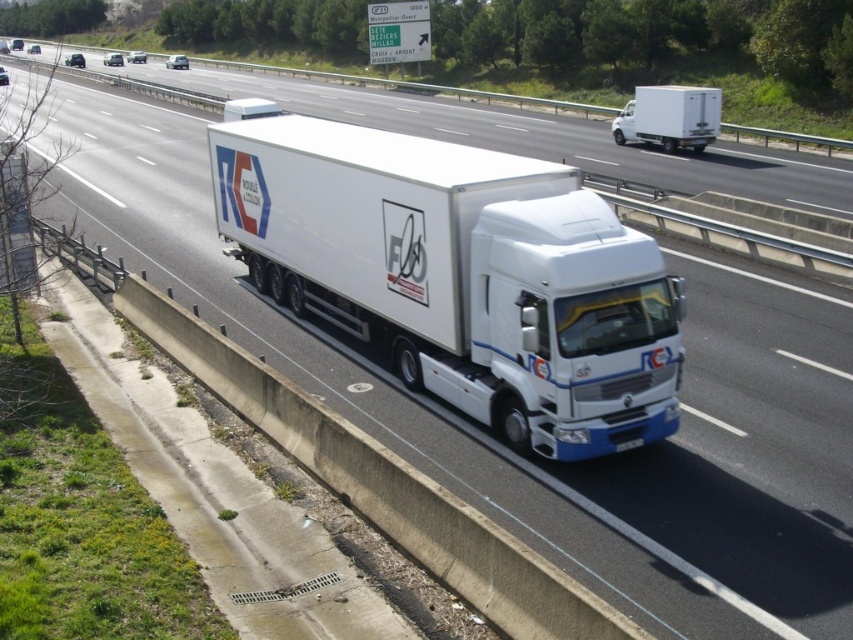
Can you confirm if white matte trailer truck at center is positioned below white glossy truck at center?

Yes, white matte trailer truck at center is below white glossy truck at center.

Is point (473, 196) farther from viewer compared to point (282, 92)?

That is False.

Which is in front, point (252, 248) or point (346, 97)?

Point (252, 248) is in front.

This screenshot has height=640, width=853. What are the coordinates of `white matte trailer truck at center` in the screenshot? It's located at (x=460, y=273).

Is white matte trailer truck at center smaller than white matte truck at upper center?

Incorrect, white matte trailer truck at center is not smaller in size than white matte truck at upper center.

Is point (447, 356) positioned before point (610, 128)?

Yes, it is in front of point (610, 128).

This screenshot has width=853, height=640. Find the location of `white matte trailer truck at center`. white matte trailer truck at center is located at coordinates (460, 273).

Is white glossy truck at center to the left of white matte truck at upper center from the viewer's perspective?

Yes, white glossy truck at center is to the left of white matte truck at upper center.

Is white glossy truck at center smaller than white matte truck at upper center?

A: Actually, white glossy truck at center might be larger than white matte truck at upper center.

Which is in front, point (196, 72) or point (648, 132)?

Point (648, 132) is more forward.

Identify the location of white glossy truck at center. (532, 134).